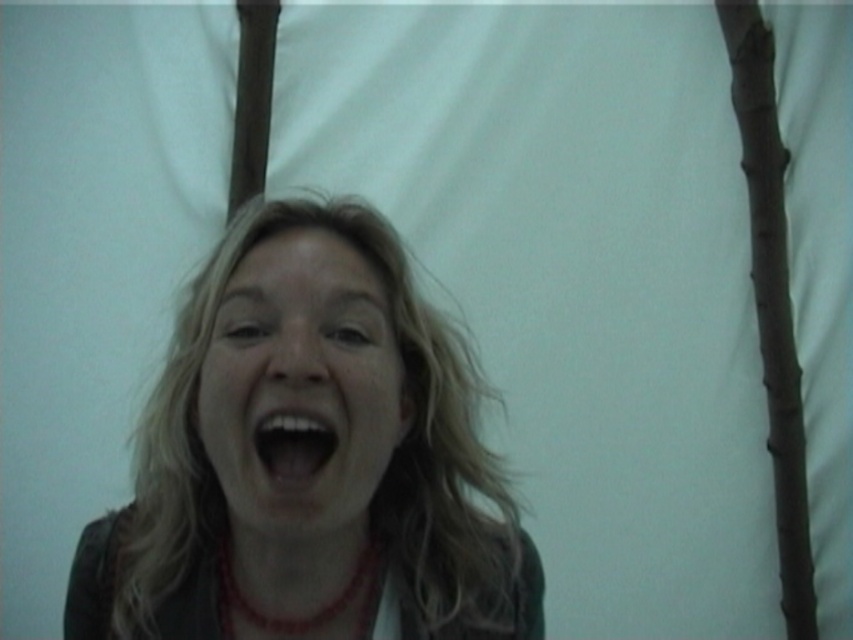
From the picture: You are a photographer adjusting your camera to capture a closeup of the smooth skin face at center. The camera requires the subject to be exactly 24 inches away for optimal focus. Based on the scene description, is the subject currently positioned at the correct distance for the camera?

The smooth skin face at center is 23.11 inches from viewer, which is slightly closer than the required 24 inches. To achieve optimal focus, the subject needs to move back approximately 0.89 inches.

You are a photographer trying to adjust the lighting for a portrait. You notice the matte brown hair at center and the smooth skin face at center in your frame. Which object is positioned to the left of the other?

The matte brown hair at center is to the left of the smooth skin face at center.